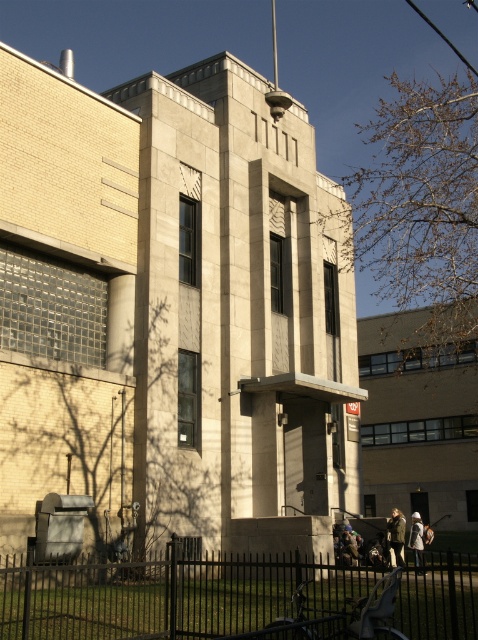
From the picture: You are a visitor approaching the building and see the black metal fence at lower center and the camouflage jacket at lower right. Which object is closer to you as you approach the building?

The black metal fence at lower center is closer to you because it is in front of the camouflage jacket at lower right.